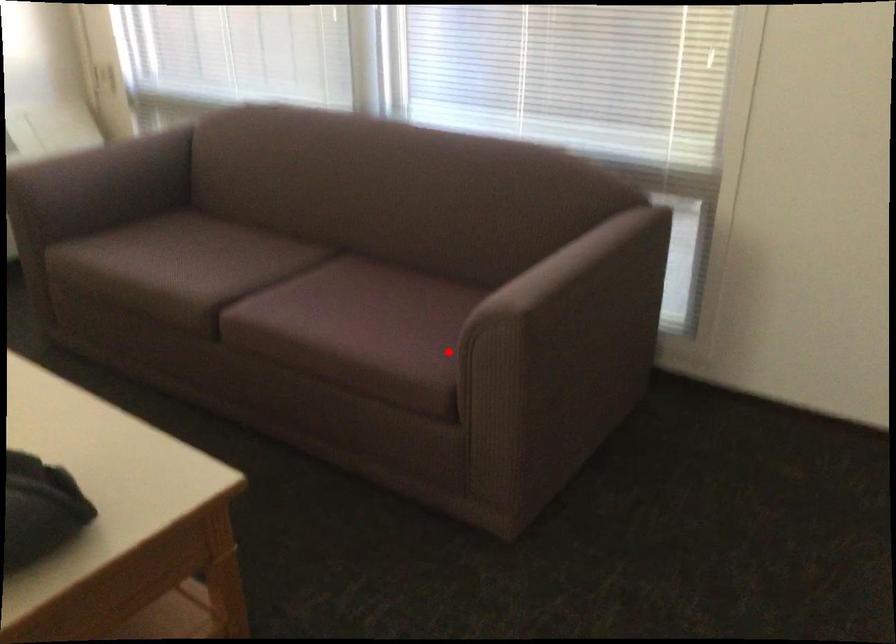
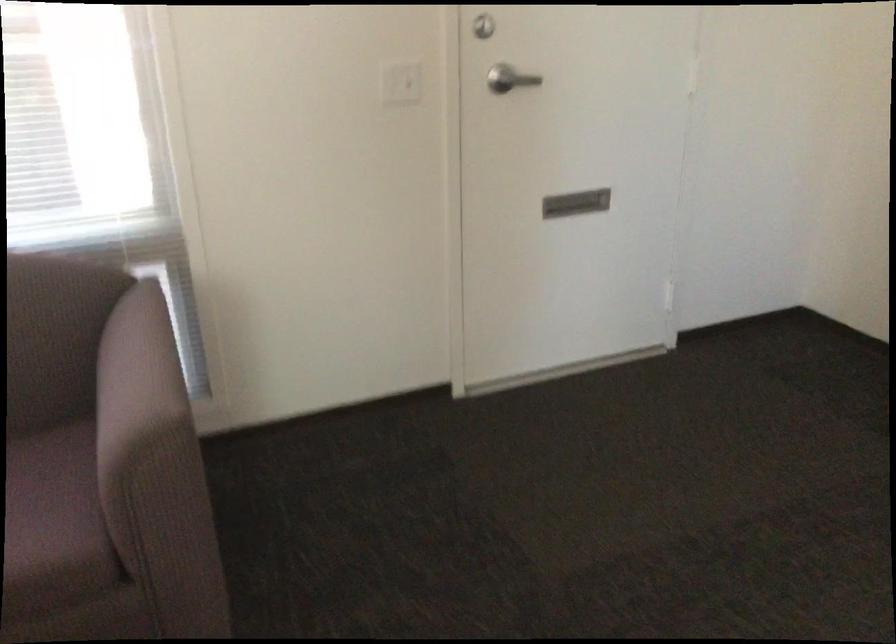
The point at the highlighted location is marked in the first image. Where is the corresponding point in the second image?

(53, 520)